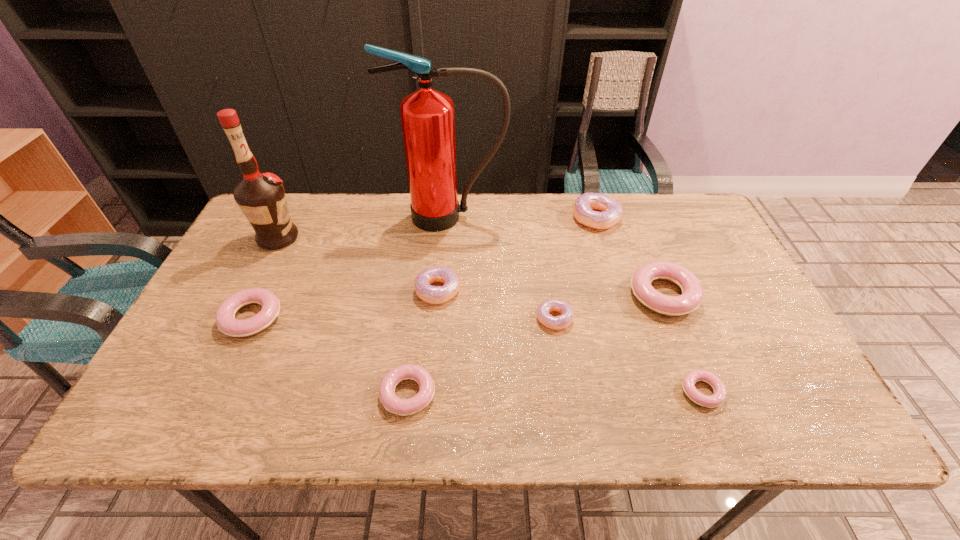
The image size is (960, 540). Find the location of `free space at the far edge of the desktop`. free space at the far edge of the desktop is located at coordinates (384, 235).

Identify the location of vacant space at the near edge of the desktop. (510, 398).

Identify the location of free space at the left edge. This screenshot has height=540, width=960. (242, 270).

What are the coordinates of `free space at the far left corner of the desktop` in the screenshot? It's located at (290, 202).

The height and width of the screenshot is (540, 960). In the image, there is a desktop. Identify the location of free space at the far right corner. (696, 227).

You are a GUI agent. You are given a task and a screenshot of the screen. Output one action in this format:
    pyautogui.click(x=<x>, y=<y>)
    Task: Click on the vacant area at the near right corner
    
    Given the screenshot: What is the action you would take?
    pyautogui.click(x=776, y=399)

Identify the location of free spot between the farthest doughnut and the second smallest purple doughnut. The height and width of the screenshot is (540, 960). (517, 254).

Find the location of `vacant area that lies between the biggest pink doughnut and the leftmost pink doughnut`. vacant area that lies between the biggest pink doughnut and the leftmost pink doughnut is located at coordinates (458, 307).

Locate an element on the screen. The width and height of the screenshot is (960, 540). free space between the smallest pink doughnut and the third smallest pink doughnut is located at coordinates (477, 355).

Identify the location of free space between the fourth object from right to left and the second smallest pink doughnut. (481, 356).